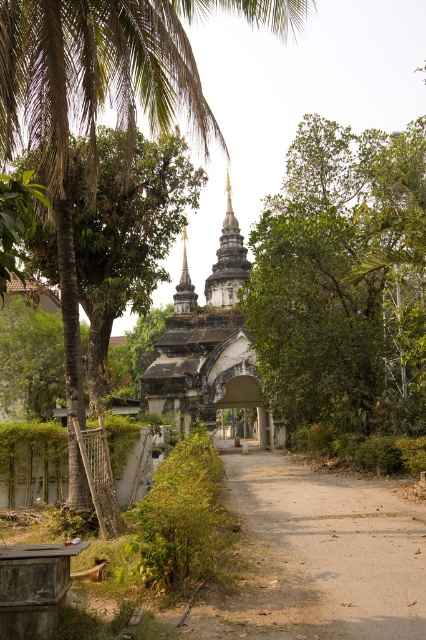
Question: Is dirt path at center to the right of white stone temple at center from the viewer's perspective?

Choices:
 (A) yes
 (B) no

Answer: (A)

Question: Does green leafy palm tree at upper left have a smaller size compared to dirt path at center?

Choices:
 (A) no
 (B) yes

Answer: (A)

Question: Which point is farther from the camera taking this photo?

Choices:
 (A) coord(36,92)
 (B) coord(345,589)

Answer: (A)

Question: Which point is closer to the camera?

Choices:
 (A) green leafy palm tree at upper left
 (B) dirt path at center

Answer: (B)

Question: Does green leafy palm tree at upper left appear under dirt path at center?

Choices:
 (A) yes
 (B) no

Answer: (B)

Question: Based on their relative distances, which object is farther from the white stone temple at center?

Choices:
 (A) green leafy palm tree at upper left
 (B) dirt path at center

Answer: (A)